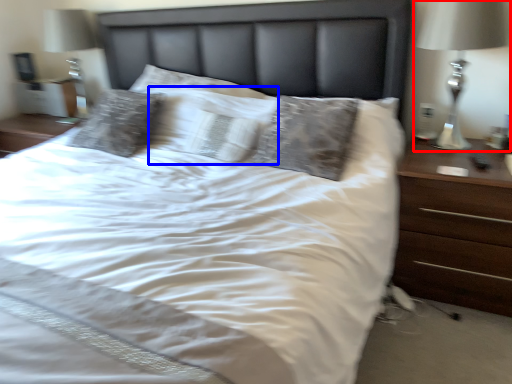
Question: Which object is further to the camera taking this photo, bedside lamp (highlighted by a red box) or pillow (highlighted by a blue box)?

Choices:
 (A) bedside lamp
 (B) pillow

Answer: (B)